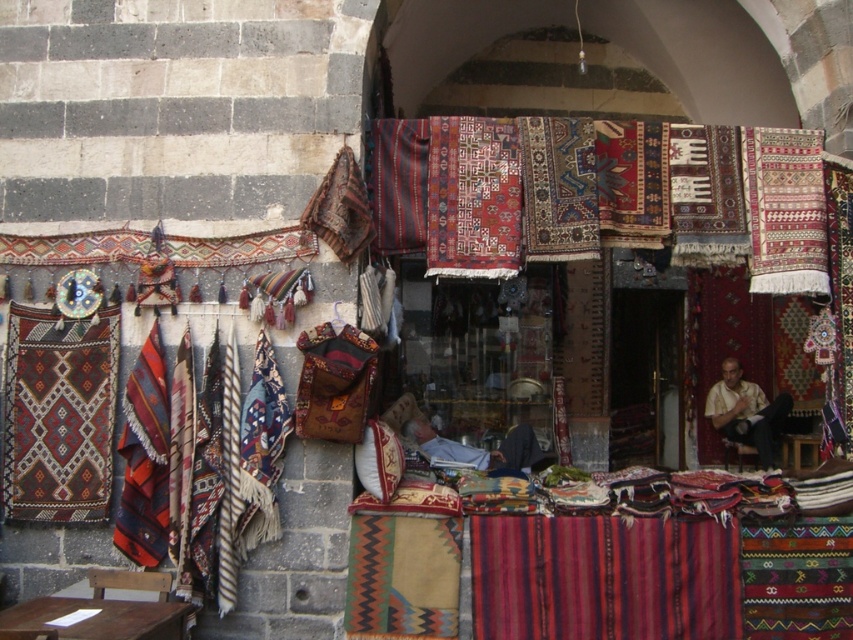
You are a customer at the market stall and want to pick up the multicolored woven rug at upper right. The display table is 2 meters long. Can you walk from the entrance of the stall to the display table without stepping on any textiles?

The distance between the entrance of the stall and the display table is 6.17 meters, which is longer than the table length of 2 meters. Therefore, you can walk to the display table without stepping on textiles as there is enough space.

You are a customer at the market stall and want to place the red woven rug at center and the light brown woven shirt at center on a shelf. Which item should you place first if you want to arrange them from widest to narrowest?

The light brown woven shirt at center should be placed first because its width is greater than the red woven rug at center.